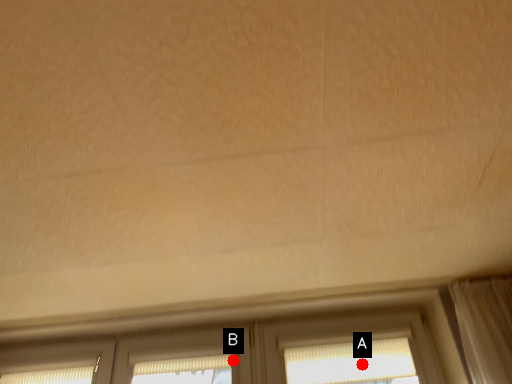
Question: Two points are circled on the image, labeled by A and B beside each circle. Which point is farther from the camera taking this photo?

Choices:
 (A) A is further
 (B) B is further

Answer: (B)